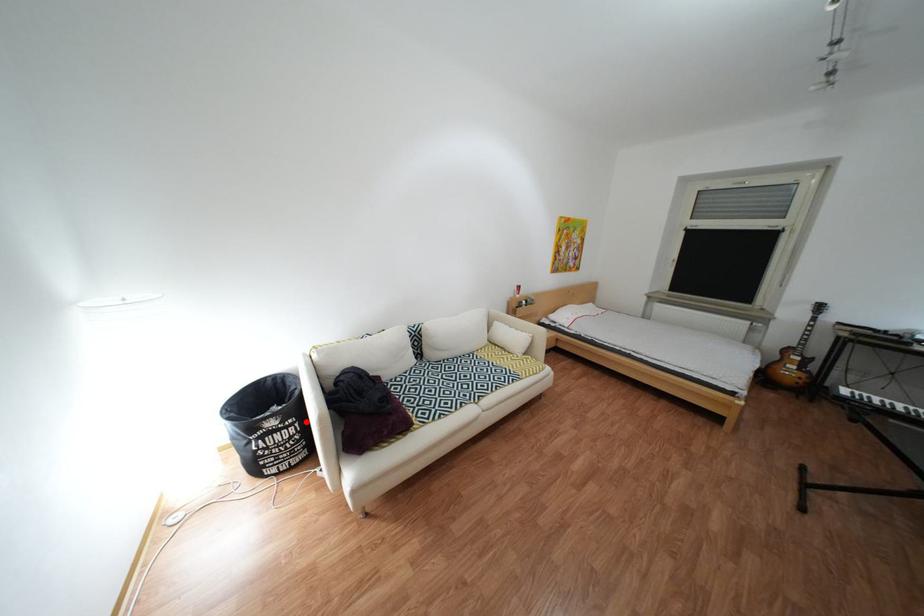
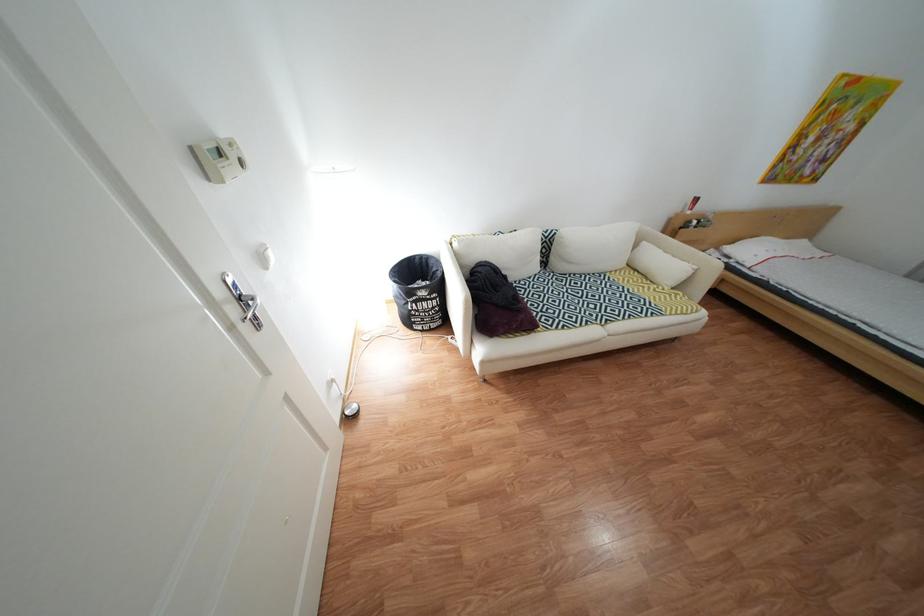
Question: I am providing you with two images of the same scene from different viewpoints. Image1 has a red point marked. In image2, the corresponding 3D location appears at what relative position? Reply with the corresponding letter.

Choices:
 (A) Closer
 (B) Farther

Answer: (A)